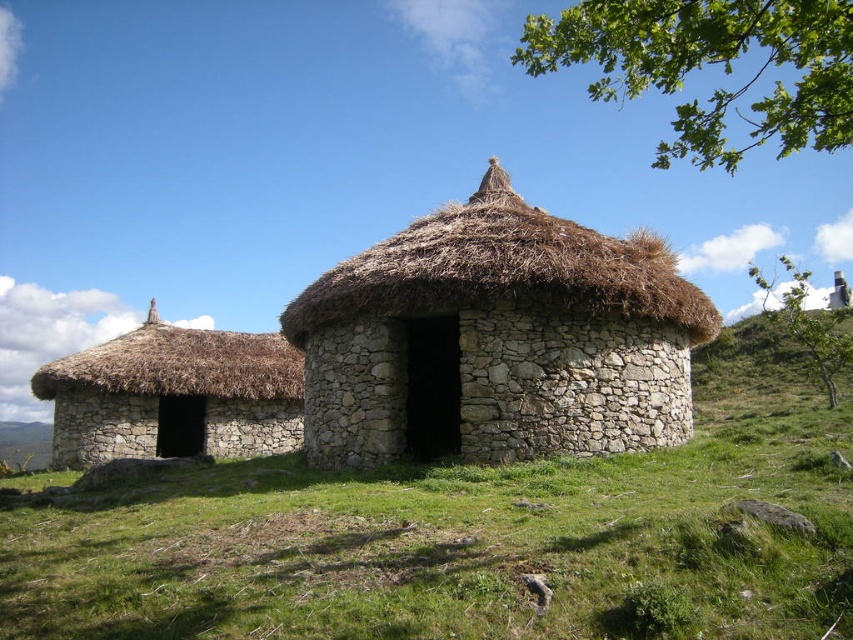
You are an artist planning to paint the scene. You want to ensure the green leafy branch at upper right and the stone thatched hut at left are proportionally accurate. Which object should you draw wider in your painting?

The green leafy branch at upper right should be drawn wider than the stone thatched hut at left because its width surpasses the stone thatched hut at left.

You are an architect designing a new garden and want to incorporate elements from this scene. You notice two green leafy plants in the upper right corner of the image. Which one is taller between the green leafy branch at upper right and the green leafy tree at upper right?

The green leafy branch at upper right is taller than the green leafy tree at upper right.

You are standing at the center of the image and want to walk towards the stone thatched hut at left. Which direction should you face to move directly towards it?

Since the stone thatched hut at left is located at point (x=173, y=396), you should face towards the left side of the image to move directly towards it.